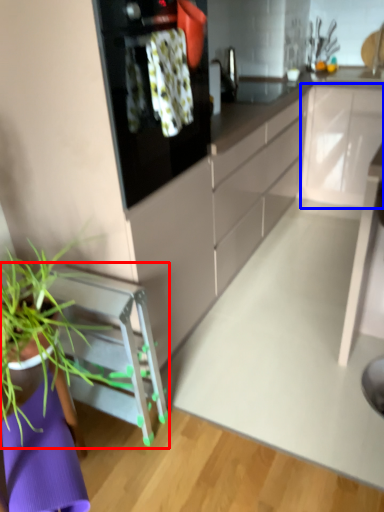
Question: Among these objects, which one is farthest to the camera, furniture (highlighted by a red box) or cabinetry (highlighted by a blue box)?

Choices:
 (A) furniture
 (B) cabinetry

Answer: (B)